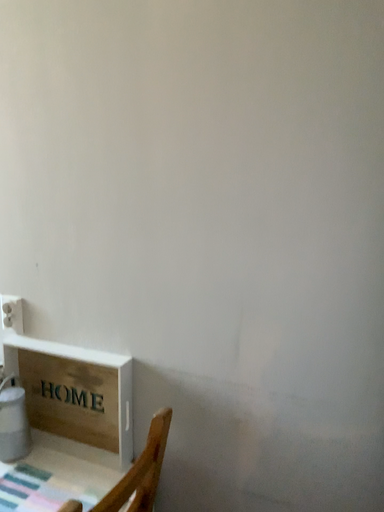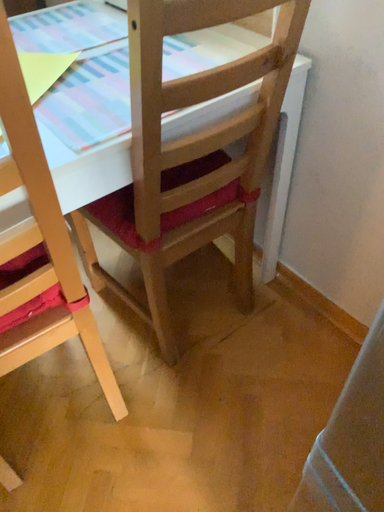
Question: How did the camera likely rotate when shooting the video?

Choices:
 (A) rotated upward
 (B) rotated downward

Answer: (B)